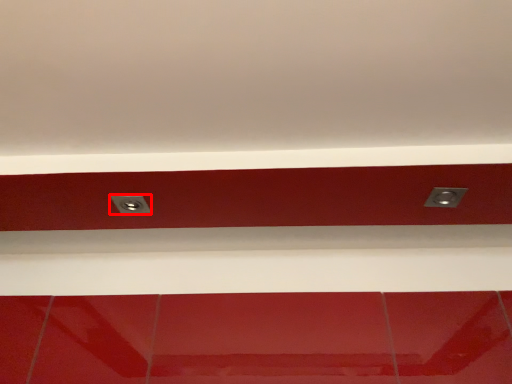
Question: Considering the relative positions of power plugs and sockets (annotated by the red box) and power plugs and sockets in the image provided, where is power plugs and sockets (annotated by the red box) located with respect to the staircase?

Choices:
 (A) left
 (B) right

Answer: (A)